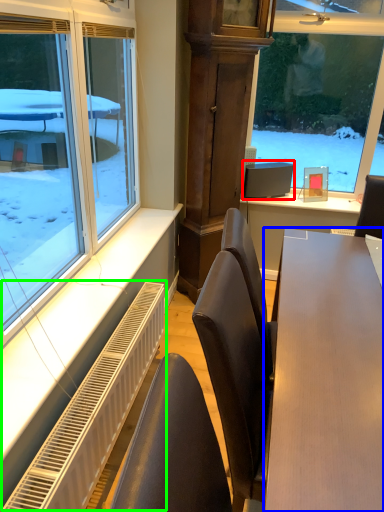
Question: Which is nearer to the computer monitor (highlighted by a red box)? table (highlighted by a blue box) or radiator (highlighted by a green box).

Choices:
 (A) table
 (B) radiator

Answer: (B)